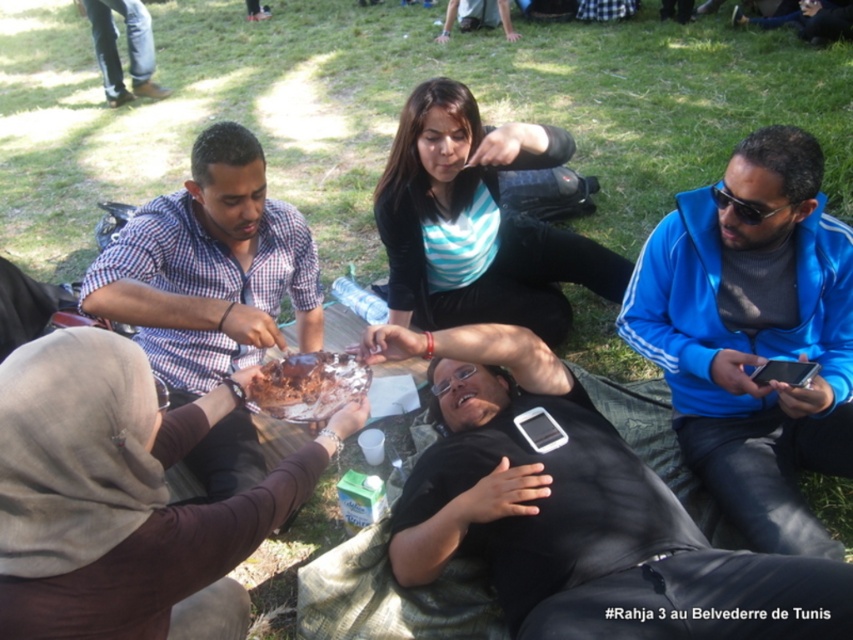
Does black matte phone at center appear on the left side of brown matte cake at center?

Incorrect, black matte phone at center is not on the left side of brown matte cake at center.

Can you confirm if black matte phone at center is wider than brown matte cake at center?

Yes, black matte phone at center is wider than brown matte cake at center.

Between point (640, 536) and point (109, 394), which one is positioned behind?

Point (640, 536)

You are a GUI agent. You are given a task and a screenshot of the screen. Output one action in this format:
    pyautogui.click(x=<x>, y=<y>)
    Task: Click on the black matte phone at center
    This screenshot has width=853, height=640.
    Given the screenshot: What is the action you would take?
    pyautogui.click(x=573, y=509)

Does point (61, 483) come in front of point (180, 193)?

Yes, point (61, 483) is closer to viewer.

Is brown matte cake at center smaller than checkered fabric shirt at left?

Correct, brown matte cake at center occupies less space than checkered fabric shirt at left.

Between point (177, 528) and point (198, 164), which one is positioned behind?

Positioned behind is point (198, 164).

At what (x,y) coordinates should I click in order to perform the action: click on brown matte cake at center. Please return your answer as a coordinate pair (x, y). The height and width of the screenshot is (640, 853). Looking at the image, I should click on (117, 492).

Can you confirm if brown matte cake at center is bigger than chocolate cake at center?

Indeed, brown matte cake at center has a larger size compared to chocolate cake at center.

Is point (3, 534) positioned in front of point (317, 355)?

Yes, point (3, 534) is closer to viewer.

Which is behind, point (10, 372) or point (258, 380)?

The point (258, 380) is more distant.

Identify the location of brown matte cake at center. (117, 492).